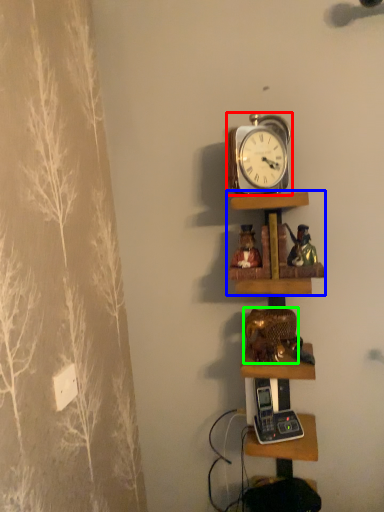
Question: Estimate the real-world distances between objects in this image. Which object is closer to alarm clock (highlighted by a red box), shelf (highlighted by a blue box) or toy (highlighted by a green box)?

Choices:
 (A) shelf
 (B) toy

Answer: (A)